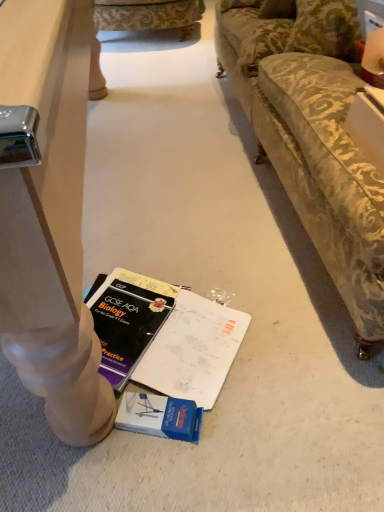
Question: Is velvet green pillow at upper right smaller than green floral fabric couch at upper center?

Choices:
 (A) yes
 (B) no

Answer: (A)

Question: Is velvet green pillow at upper right turned away from green floral fabric couch at upper center?

Choices:
 (A) yes
 (B) no

Answer: (B)

Question: Considering the relative positions of velvet green pillow at upper right and green floral fabric couch at upper center in the image provided, is velvet green pillow at upper right behind green floral fabric couch at upper center?

Choices:
 (A) no
 (B) yes

Answer: (A)

Question: Considering the relative sizes of velvet green pillow at upper right and green floral fabric couch at upper center in the image provided, is velvet green pillow at upper right bigger than green floral fabric couch at upper center?

Choices:
 (A) yes
 (B) no

Answer: (B)

Question: From a real-world perspective, is velvet green pillow at upper right located higher than green floral fabric couch at upper center?

Choices:
 (A) no
 (B) yes

Answer: (B)

Question: Could green floral fabric couch at upper center be considered to be inside velvet green pillow at upper right?

Choices:
 (A) yes
 (B) no

Answer: (B)

Question: Considering the relative sizes of green floral fabric couch at upper center and velvet green pillow at upper right in the image provided, is green floral fabric couch at upper center taller than velvet green pillow at upper right?

Choices:
 (A) no
 (B) yes

Answer: (B)

Question: From the image's perspective, does green floral fabric couch at upper center appear higher than velvet green pillow at upper right?

Choices:
 (A) no
 (B) yes

Answer: (B)

Question: Is green floral fabric couch at upper center directly adjacent to velvet green pillow at upper right?

Choices:
 (A) no
 (B) yes

Answer: (A)

Question: Considering the relative positions of green floral fabric couch at upper center and velvet green pillow at upper right in the image provided, is green floral fabric couch at upper center behind velvet green pillow at upper right?

Choices:
 (A) no
 (B) yes

Answer: (B)

Question: Is green floral fabric couch at upper center not within velvet green pillow at upper right?

Choices:
 (A) no
 (B) yes

Answer: (B)

Question: From a real-world perspective, is green floral fabric couch at upper center physically above velvet green pillow at upper right?

Choices:
 (A) no
 (B) yes

Answer: (A)

Question: Is velvet green pillow at upper right to the left or to the right of green floral fabric couch at upper center in the image?

Choices:
 (A) left
 (B) right

Answer: (B)